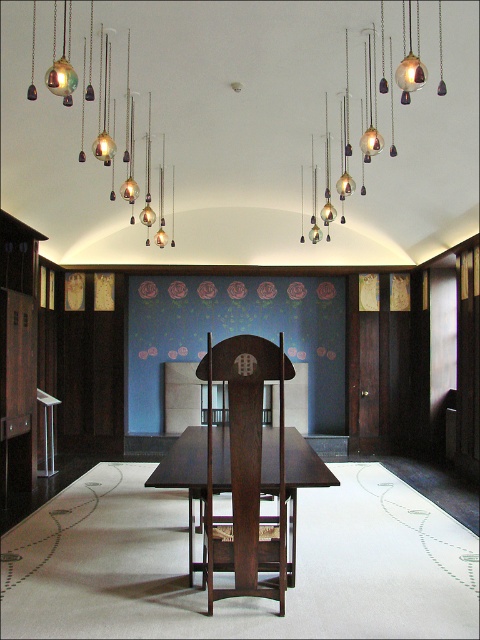
You are a visitor standing in the room and want to take a photo of the dark wood chair at center and the metallic glass globe chandelier at upper left. Which object should you focus on first if you want both to be in sharp focus?

You should focus on the dark wood chair at center first because it is closer to you than the metallic glass globe chandelier at upper left, so focusing on the closer object will ensure both are in focus.

You are standing in the room and want to reach the metallic glass globe chandelier at upper left. Considering your height is 1.7 meters, can you touch it without any tools?

The metallic glass globe chandelier at upper left is 3.91 meters from viewer, so you cannot touch it without tools since it is higher than your reach.

You are standing in the room and want to place a small decorative item exactly at the coordinates point (x=184, y=476). According to the scene description, where will this item be placed?

The point (x=184, y=476) corresponds to the dark wood table at center, so placing the item there would put it on the dark wood table at center.